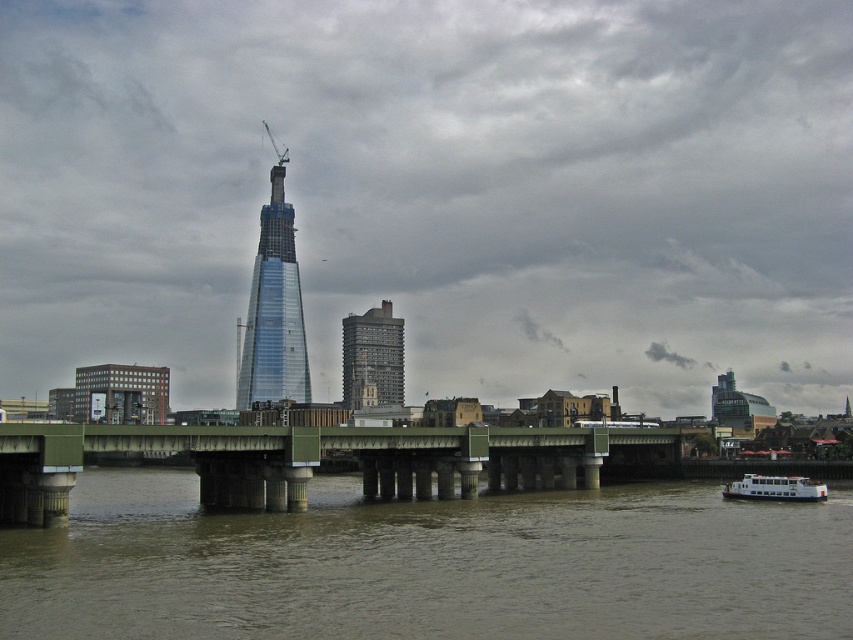
Question: Can you confirm if brown muddy water at lower center is wider than dark gray concrete building at center?

Choices:
 (A) no
 (B) yes

Answer: (B)

Question: Is green concrete bridge at center thinner than white matte boat at lower right?

Choices:
 (A) no
 (B) yes

Answer: (A)

Question: Which object appears farthest from the camera in this image?

Choices:
 (A) green concrete bridge at center
 (B) brown muddy water at lower center
 (C) transparent glass tower at center

Answer: (C)

Question: Is green concrete bridge at center above dark gray concrete building at center?

Choices:
 (A) yes
 (B) no

Answer: (A)

Question: Estimate the real-world distances between objects in this image. Which object is farther from the dark gray concrete building at center?

Choices:
 (A) white matte boat at lower right
 (B) brown muddy water at lower center
 (C) green concrete bridge at center

Answer: (A)

Question: Which object is closer to the camera taking this photo?

Choices:
 (A) transparent glass tower at center
 (B) green concrete bridge at center
 (C) dark gray concrete building at center

Answer: (B)